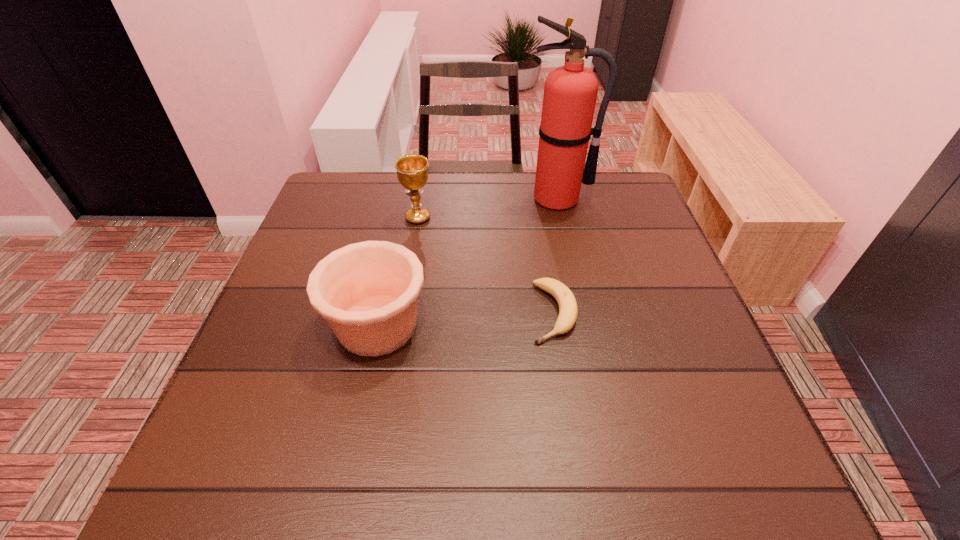
Find the location of `object positioned at the left edge`. object positioned at the left edge is located at coordinates (368, 292).

Find the location of a particular element. The height and width of the screenshot is (540, 960). object situated at the right edge is located at coordinates (570, 91).

Find the location of a particular element. object positioned at the far right corner is located at coordinates (570, 91).

I want to click on vacant space at the far edge, so click(442, 197).

Locate an element on the screen. The height and width of the screenshot is (540, 960). free space at the near edge of the desktop is located at coordinates (645, 468).

This screenshot has height=540, width=960. Identify the location of vacant space at the left edge of the desktop. click(x=342, y=246).

Locate an element on the screen. This screenshot has width=960, height=540. vacant space at the right edge is located at coordinates (682, 291).

In the image, there is a desktop. Where is `free space at the far left corner`? free space at the far left corner is located at coordinates (345, 178).

At what (x,y) coordinates should I click in order to perform the action: click on vacant space at the far right corner of the desktop. Please return your answer as a coordinate pair (x, y). This screenshot has height=540, width=960. Looking at the image, I should click on (639, 217).

You are a GUI agent. You are given a task and a screenshot of the screen. Output one action in this format:
    pyautogui.click(x=<x>, y=<y>)
    Task: Click on the vacant space that is in between the shortest object and the pottery
    The width and height of the screenshot is (960, 540).
    Given the screenshot: What is the action you would take?
    466,319